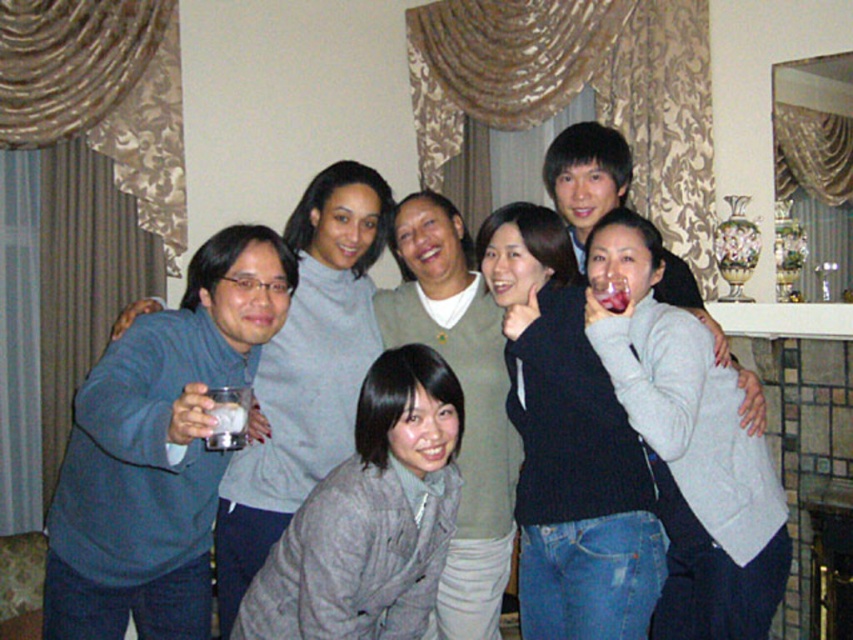
Question: Among these objects, which one is nearest to the camera?

Choices:
 (A) gray fuzzy coat at lower center
 (B) matte gray sweater at center
 (C) matte glass cup at center-left

Answer: (C)

Question: Is dark blue sweater at center positioned behind clear glass at upper center?

Choices:
 (A) yes
 (B) no

Answer: (B)

Question: Does matte glass cup at center-left have a smaller size compared to gray fuzzy coat at lower center?

Choices:
 (A) no
 (B) yes

Answer: (A)

Question: Which object appears farthest from the camera in this image?

Choices:
 (A) gray fuzzy coat at lower center
 (B) matte gray sweater at center
 (C) clear glass at upper center
 (D) dark blue sweater at center

Answer: (B)

Question: Is dark blue sweater at center positioned at the back of clear glass at upper center?

Choices:
 (A) yes
 (B) no

Answer: (B)

Question: Which point is farther from the camera taking this photo?

Choices:
 (A) (419, 396)
 (B) (351, 339)

Answer: (B)